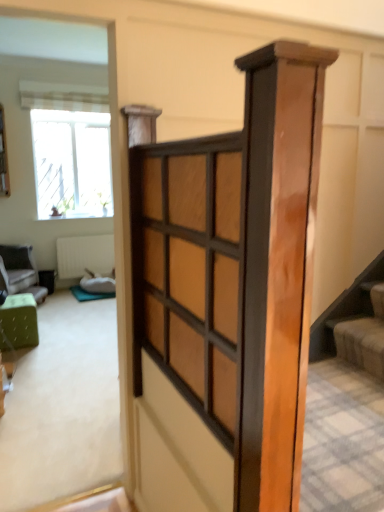
Image resolution: width=384 pixels, height=512 pixels. Identify the location of spots to the right of green fabric ottoman at left, positioned as the first furniture in left-to-right order. (57, 306).